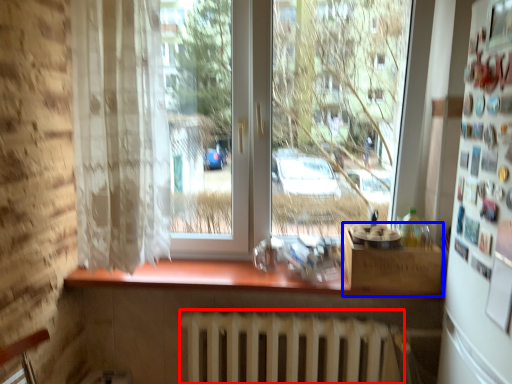
Question: Which point is further to the camera, radiator (highlighted by a red box) or window box (highlighted by a blue box)?

Choices:
 (A) radiator
 (B) window box

Answer: (B)